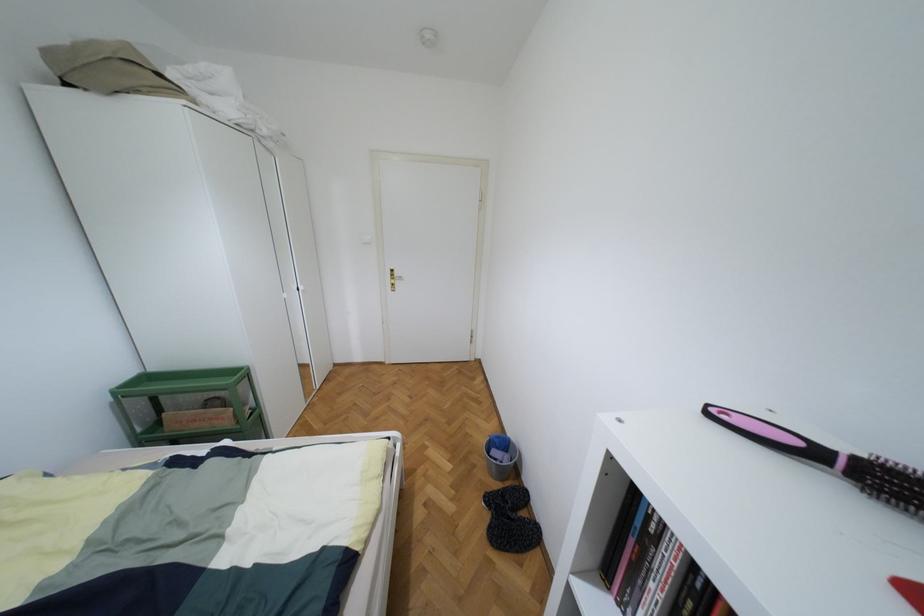
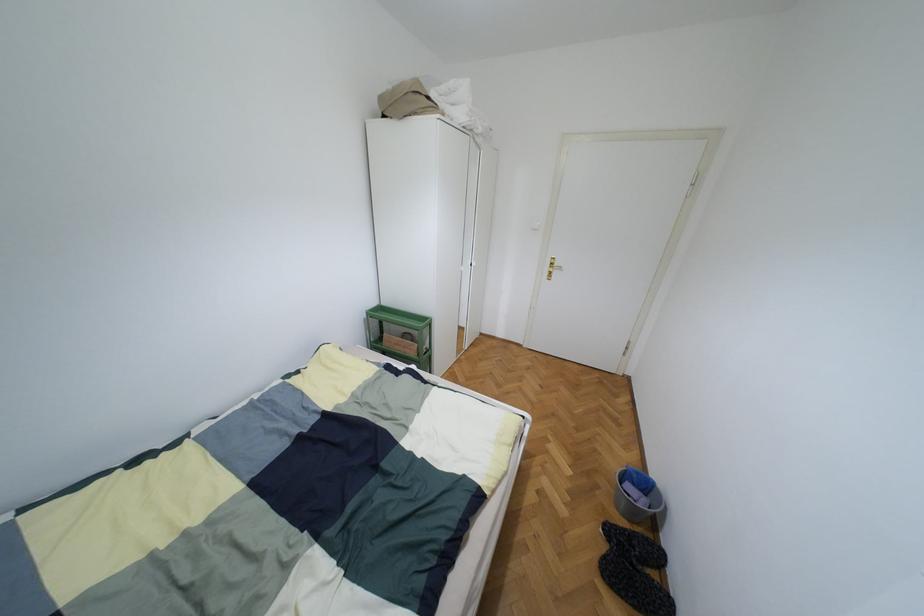
Question: The first image is from the beginning of the video and the second image is from the end. How did the camera likely rotate when shooting the video?

Choices:
 (A) Left
 (B) Right
 (C) Up
 (D) Down

Answer: (A)